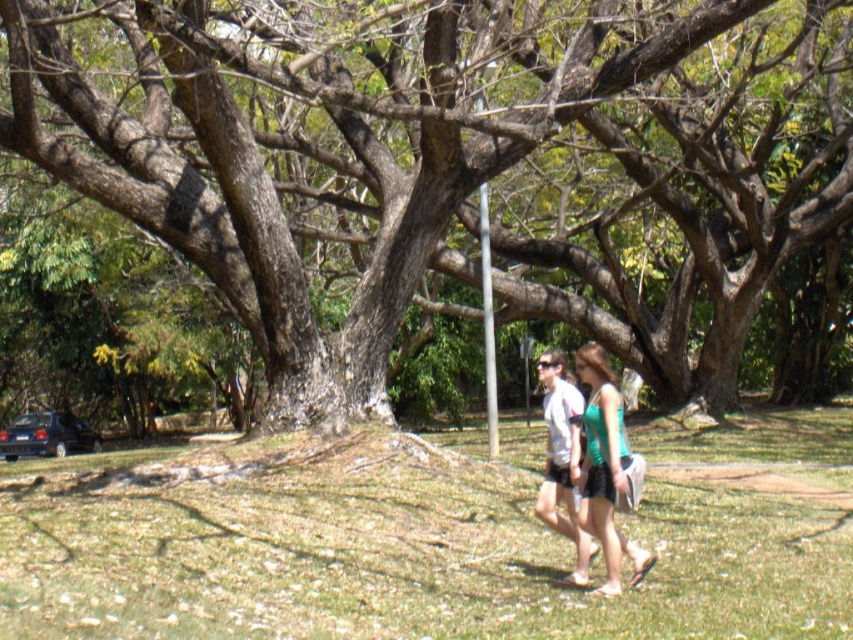
Is brown rough tree at center to the left of green fabric shorts at center from the viewer's perspective?

In fact, brown rough tree at center is to the right of green fabric shorts at center.

Does brown rough tree at center appear on the right side of green fabric shorts at center?

Indeed, brown rough tree at center is positioned on the right side of green fabric shorts at center.

Which is behind, point (38, 70) or point (576, 468)?

Point (38, 70)

The width and height of the screenshot is (853, 640). What are the coordinates of `brown rough tree at center` in the screenshot? It's located at (337, 164).

Can you confirm if green grass at center is bigger than green fabric shorts at center?

Yes, green grass at center is bigger than green fabric shorts at center.

Based on the photo, is green grass at center smaller than green fabric shorts at center?

Actually, green grass at center might be larger than green fabric shorts at center.

Is point (791, 540) positioned before point (587, 429)?

No.

At what (x,y) coordinates should I click in order to perform the action: click on green grass at center. Please return your answer as a coordinate pair (x, y). This screenshot has height=640, width=853. Looking at the image, I should click on (445, 547).

Who is lower down, green grass at center or brown rough tree at center?

green grass at center

How much distance is there between green grass at center and brown rough tree at center?

green grass at center and brown rough tree at center are 14.64 feet apart from each other.

Which is in front, point (451, 534) or point (241, 170)?

Positioned in front is point (451, 534).

Where is `green grass at center`? The height and width of the screenshot is (640, 853). green grass at center is located at coordinates (445, 547).